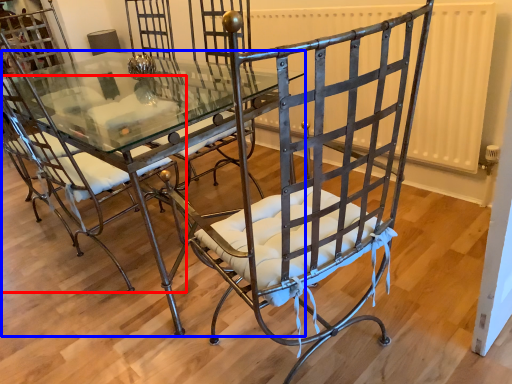
Question: Which object appears farthest to the camera in this image, chair (highlighted by a red box) or table (highlighted by a blue box)?

Choices:
 (A) chair
 (B) table

Answer: (B)